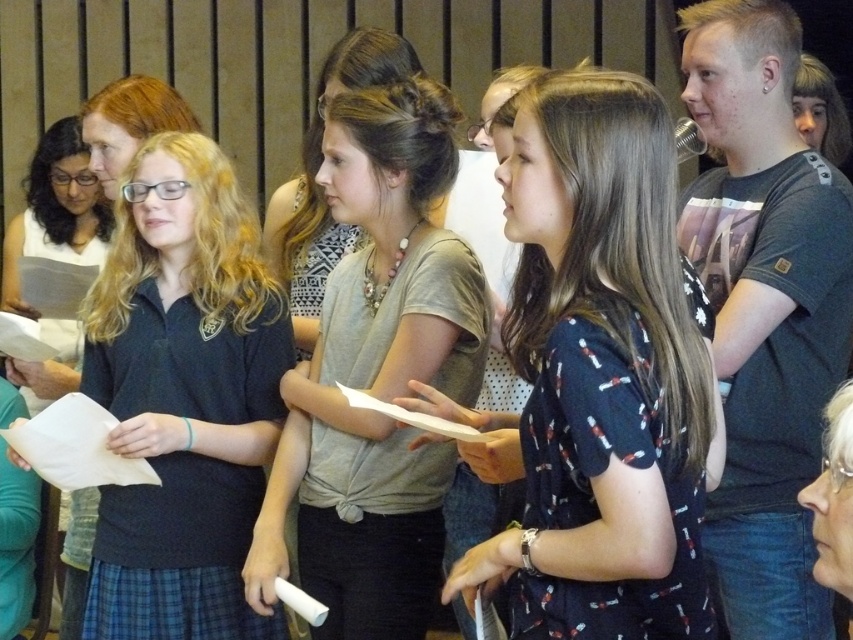
Can you confirm if dark blue uniform at center is shorter than matte gray shirt at center?

Yes.

Does point (222, 525) lie behind point (439, 282)?

That is True.

Identify the location of dark blue uniform at center. (183, 397).

Does dark blue uniform at center have a lesser height compared to matte black shirt at upper left?

No.

Who is shorter, dark blue uniform at center or matte black shirt at upper left?

Standing shorter between the two is matte black shirt at upper left.

Who is more distant from viewer, (178, 394) or (48, 163)?

Positioned behind is point (48, 163).

You are a GUI agent. You are given a task and a screenshot of the screen. Output one action in this format:
    pyautogui.click(x=<x>, y=<y>)
    Task: Click on the dark blue uniform at center
    
    Given the screenshot: What is the action you would take?
    pyautogui.click(x=183, y=397)

Can you confirm if dark blue printed dress at center is taller than dark blue uniform at center?

In fact, dark blue printed dress at center may be shorter than dark blue uniform at center.

Which is behind, point (567, 77) or point (160, 236)?

The point (160, 236) is more distant.

Is point (634, 276) closer to camera compared to point (134, 628)?

Yes, point (634, 276) is in front of point (134, 628).

You are a GUI agent. You are given a task and a screenshot of the screen. Output one action in this format:
    pyautogui.click(x=<x>, y=<y>)
    Task: Click on the dark blue printed dress at center
    
    Given the screenshot: What is the action you would take?
    pyautogui.click(x=604, y=376)